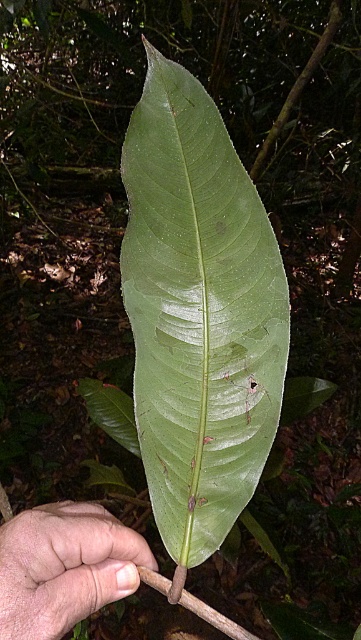
Question: Does green smooth leaf at center appear over skinny flesh at lower left?

Choices:
 (A) no
 (B) yes

Answer: (B)

Question: Does green smooth leaf at center appear on the left side of skinny flesh at lower left?

Choices:
 (A) yes
 (B) no

Answer: (B)

Question: Which point is farther to the camera?

Choices:
 (A) (42, 628)
 (B) (194, 465)

Answer: (B)

Question: Is green smooth leaf at center closer to camera compared to skinny flesh at lower left?

Choices:
 (A) no
 (B) yes

Answer: (B)

Question: Which point appears closest to the camera in this image?

Choices:
 (A) (99, 525)
 (B) (155, 355)

Answer: (B)